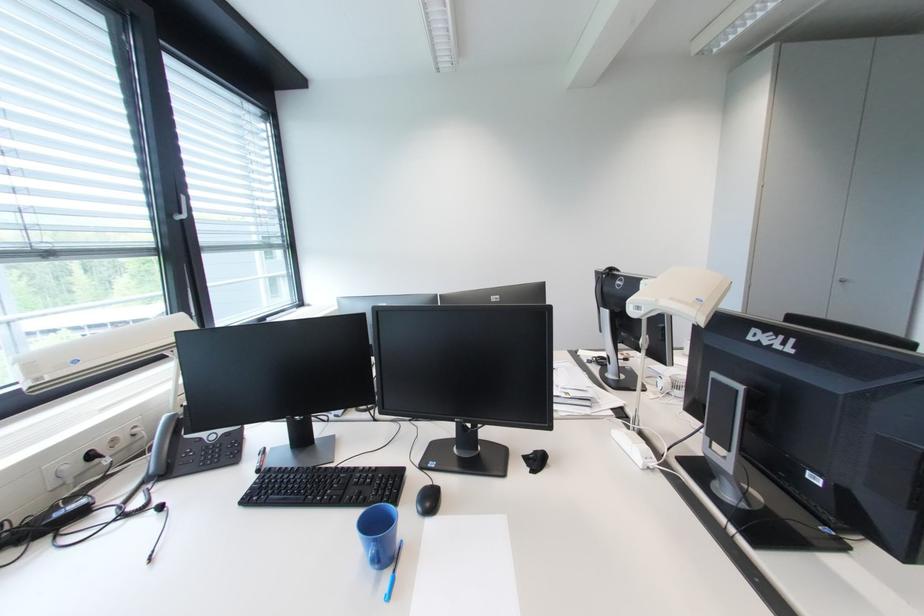
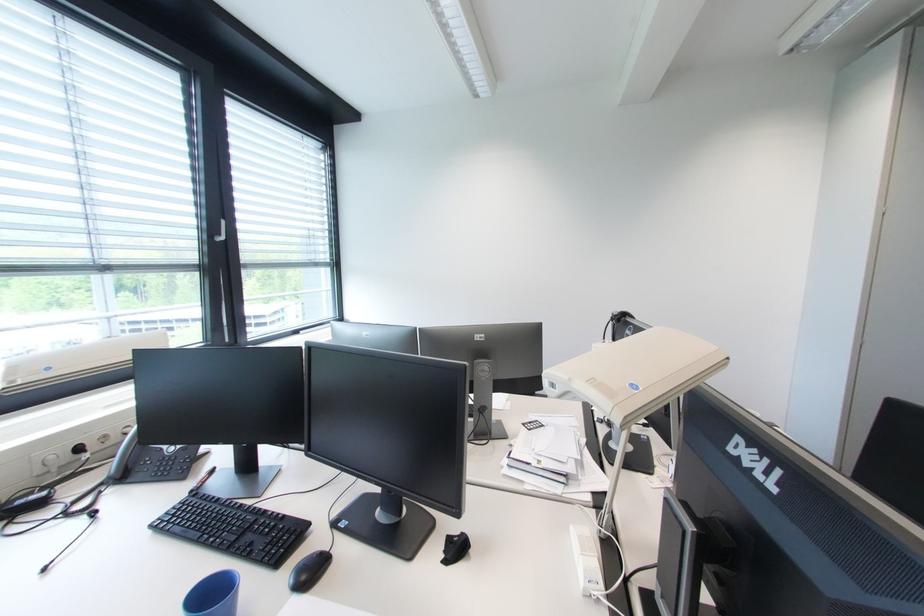
In the second image, find the point that corresponds to point (383, 469) in the first image.

(290, 517)